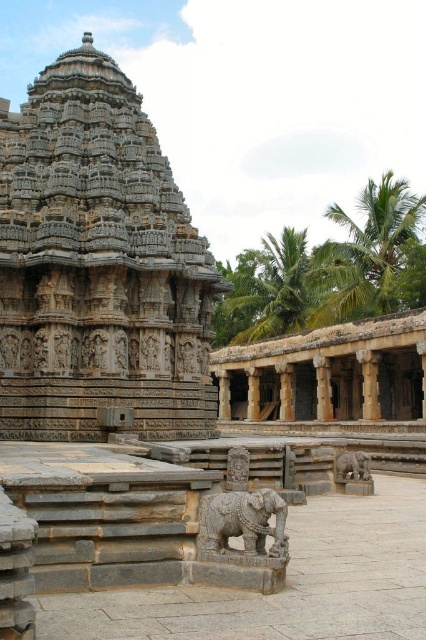
You are standing in front of the temple complex and want to take a photo that includes both the gray stone hindu temple at center and the brown stone pillar at center. Based on their positions, which one should you place on the left side of your photo to include both in the frame?

To include both the gray stone hindu temple at center and the brown stone pillar at center in the frame, you should place the gray stone hindu temple at center on the left side of your photo since it is already positioned to the left of the brown stone pillar at center.

You are a visitor standing in front of the gray stone hindu temple at center and the carved stone elephant at center. Which object is closer to you?

The gray stone hindu temple at center is closer to you than the carved stone elephant at center.